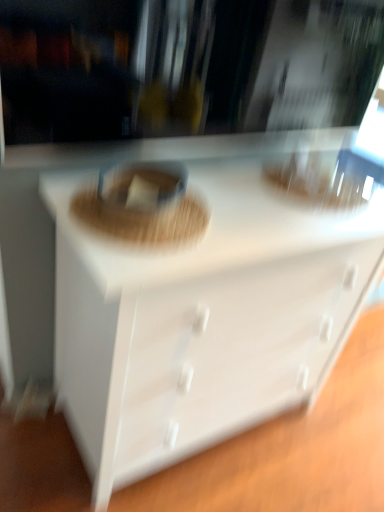
The width and height of the screenshot is (384, 512). What are the coordinates of `brown woven basket at center` in the screenshot? It's located at 143,205.

Describe the element at coordinates (143, 205) in the screenshot. I see `brown woven basket at center` at that location.

Measure the distance between point (306, 271) and camera.

The depth of point (306, 271) is 1.23 meters.

Describe the element at coordinates (206, 311) in the screenshot. I see `white glossy chest of drawers at center` at that location.

Locate an element on the screen. Image resolution: width=384 pixels, height=512 pixels. white glossy chest of drawers at center is located at coordinates click(206, 311).

Find the location of `brown woven basket at center`. brown woven basket at center is located at coordinates (143, 205).

Looking at this image, between white glossy chest of drawers at center and brown woven basket at center, which one appears on the right side from the viewer's perspective?

white glossy chest of drawers at center.

Is the position of white glossy chest of drawers at center less distant than that of brown woven basket at center?

That is True.

Which point is more distant from viewer, (178,339) or (98,227)?

The point (178,339) is farther from the camera.

From the image's perspective, is white glossy chest of drawers at center located above or below brown woven basket at center?

Based on their image positions, white glossy chest of drawers at center is located beneath brown woven basket at center.

From a real-world perspective, which is physically above, white glossy chest of drawers at center or brown woven basket at center?

brown woven basket at center, from a real-world perspective.

Can you confirm if white glossy chest of drawers at center is wider than brown woven basket at center?

Indeed, white glossy chest of drawers at center has a greater width compared to brown woven basket at center.

Is white glossy chest of drawers at center taller than brown woven basket at center?

Yes.

Between white glossy chest of drawers at center and brown woven basket at center, which one has smaller size?

brown woven basket at center is smaller.

Would you say white glossy chest of drawers at center is inside or outside brown woven basket at center?

white glossy chest of drawers at center exists outside the volume of brown woven basket at center.

Is white glossy chest of drawers at center next to brown woven basket at center?

white glossy chest of drawers at center and brown woven basket at center are not in contact.

Is brown woven basket at center at the back of white glossy chest of drawers at center?

That's not correct — white glossy chest of drawers at center is not looking away from brown woven basket at center.

Can you tell me how much white glossy chest of drawers at center and brown woven basket at center differ in facing direction?

There is a 0.88-degree angle between the facing directions of white glossy chest of drawers at center and brown woven basket at center.

Identify the location of food behind the white glossy chest of drawers at center. The width and height of the screenshot is (384, 512). (143, 205).

Visually, is brown woven basket at center positioned to the left or to the right of white glossy chest of drawers at center?

In the image, brown woven basket at center appears on the left side of white glossy chest of drawers at center.

Which object is closer to the camera taking this photo, brown woven basket at center or white glossy chest of drawers at center?

white glossy chest of drawers at center is in front.

Is point (197, 225) closer or farther from the camera than point (283, 225)?

Clearly, point (197, 225) is closer to the camera than point (283, 225).

From the image's perspective, is brown woven basket at center above or below white glossy chest of drawers at center?

brown woven basket at center is above white glossy chest of drawers at center.

From a real-world perspective, is brown woven basket at center under white glossy chest of drawers at center?

No, from a real-world perspective, brown woven basket at center is not under white glossy chest of drawers at center.

Looking at their sizes, would you say brown woven basket at center is wider or thinner than white glossy chest of drawers at center?

In the image, brown woven basket at center appears to be more narrow than white glossy chest of drawers at center.

Considering the sizes of objects brown woven basket at center and white glossy chest of drawers at center in the image provided, who is shorter, brown woven basket at center or white glossy chest of drawers at center?

Standing shorter between the two is brown woven basket at center.

Can you confirm if brown woven basket at center is smaller than white glossy chest of drawers at center?

Yes, brown woven basket at center is smaller than white glossy chest of drawers at center.

Can we say brown woven basket at center lies outside white glossy chest of drawers at center?

Indeed, brown woven basket at center is completely outside white glossy chest of drawers at center.

Is the surface of brown woven basket at center in direct contact with white glossy chest of drawers at center?

No, brown woven basket at center is not beside white glossy chest of drawers at center.

Is brown woven basket at center looking in the opposite direction of white glossy chest of drawers at center?

No, white glossy chest of drawers at center is not at the back of brown woven basket at center.

Can you tell me how much brown woven basket at center and white glossy chest of drawers at center differ in facing direction?

The angular difference between brown woven basket at center and white glossy chest of drawers at center is 0.88 degrees.

There is a white glossy chest of drawers at center. Find the location of `food above it (from a real-world perspective)`. food above it (from a real-world perspective) is located at coordinates [143, 205].

Where is `food located behind the white glossy chest of drawers at center`? This screenshot has width=384, height=512. food located behind the white glossy chest of drawers at center is located at coordinates (143, 205).

You are a GUI agent. You are given a task and a screenshot of the screen. Output one action in this format:
    pyautogui.click(x=<x>, y=<y>)
    Task: Click on the chest of drawers below the brown woven basket at center (from a real-world perspective)
    The image size is (384, 512).
    Given the screenshot: What is the action you would take?
    pyautogui.click(x=206, y=311)